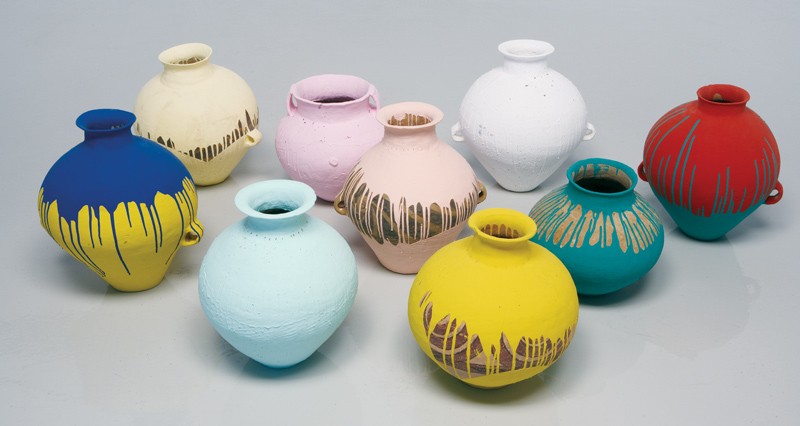
At what (x,y) coordinates should I click in order to perform the action: click on handle. Please return your answer as a coordinate pair (x, y). This screenshot has height=426, width=800. Looking at the image, I should click on (780, 191).